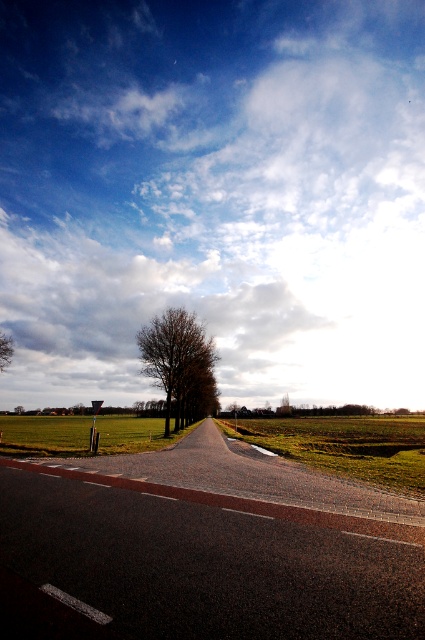
You are standing on the road and looking towards the horizon. Which object is closer to you, the cloudy sky at upper center or the bare branches at left?

The cloudy sky at upper center is further away than the bare branches at left, so the bare branches at left are closer to you.

You are standing at the edge of the road and looking towards the center of the image. Which object is closer to the ground between the green grassy field at center and the bare branches at center?

The green grassy field at center is closer to the ground as it is positioned below the bare branches at center.

You are standing on the road and looking towards the horizon. Which object is positioned to the left of the other between the cloudy sky at upper center and the green grassy field at center?

The cloudy sky at upper center is positioned to the left of the green grassy field at center.